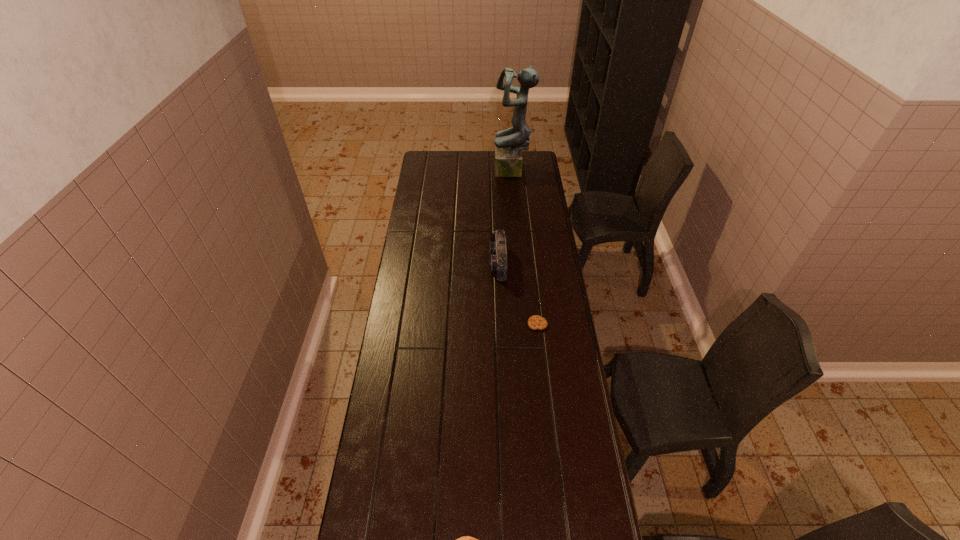
The height and width of the screenshot is (540, 960). Find the location of `the tallest object`. the tallest object is located at coordinates (509, 143).

At what (x,y) coordinates should I click in order to perform the action: click on the farthest object. Please return your answer as a coordinate pair (x, y). The width and height of the screenshot is (960, 540). Looking at the image, I should click on (509, 143).

Locate an element on the screen. The width and height of the screenshot is (960, 540). the second tallest object is located at coordinates (497, 249).

Identify the location of camcorder. The width and height of the screenshot is (960, 540). (497, 249).

Identify the location of the right cookie. This screenshot has width=960, height=540. (535, 322).

Where is `the farther cookie`? the farther cookie is located at coordinates (535, 322).

The height and width of the screenshot is (540, 960). What are the coordinates of `free space located 0.180m on the face of the sculpture` in the screenshot? It's located at click(x=463, y=172).

The image size is (960, 540). I want to click on free space located 0.070m on the face of the sculpture, so click(x=481, y=172).

The width and height of the screenshot is (960, 540). In order to click on free space located 0.310m on the face of the sculpture in this screenshot , I will do `click(441, 172)`.

You are a GUI agent. You are given a task and a screenshot of the screen. Output one action in this format:
    pyautogui.click(x=<x>, y=<y>)
    Task: Click on the vacant space located on the front-facing side of the camcorder
    
    Given the screenshot: What is the action you would take?
    pyautogui.click(x=468, y=263)